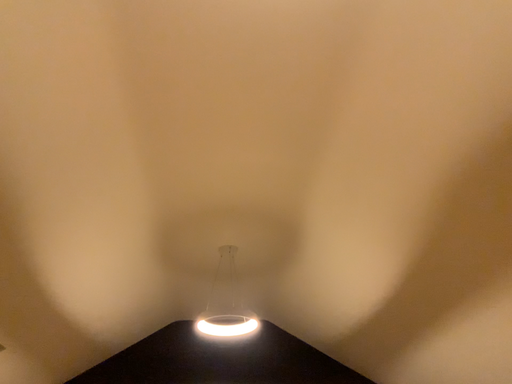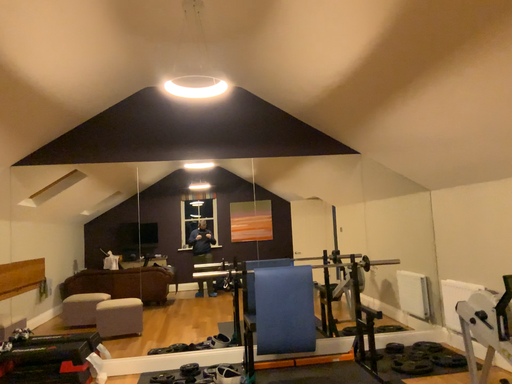
Question: How did the camera likely rotate when shooting the video?

Choices:
 (A) rotated downward
 (B) rotated upward

Answer: (A)